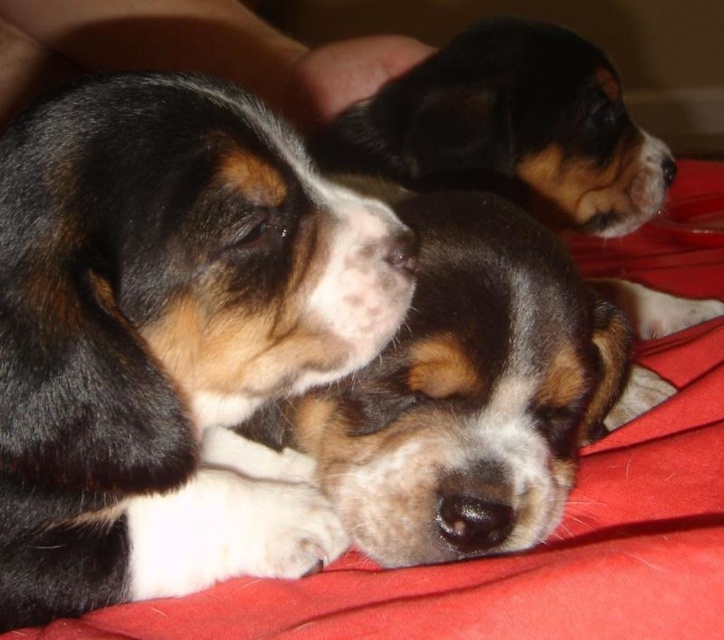
Is point (433, 426) closer to viewer compared to point (319, 60)?

Yes, it is in front of point (319, 60).

Does tri-color fur beagle at center have a greater height compared to smooth skin hand at upper left?

Yes, tri-color fur beagle at center is taller than smooth skin hand at upper left.

Identify the location of tri-color fur beagle at center. (488, 296).

Is tri-color fur puppy at center thinner than smooth skin hand at upper left?

Yes, tri-color fur puppy at center is thinner than smooth skin hand at upper left.

Is point (253, 486) positioned before point (277, 64)?

Yes, point (253, 486) is in front of point (277, 64).

Does point (38, 589) lie behind point (294, 72)?

That is False.

You are a GUI agent. You are given a task and a screenshot of the screen. Output one action in this format:
    pyautogui.click(x=<x>, y=<y>)
    Task: Click on the tri-color fur puppy at center
    Image resolution: width=724 pixels, height=640 pixels.
    Given the screenshot: What is the action you would take?
    pyautogui.click(x=169, y=339)

Which is in front, point (266, 189) or point (471, 412)?

Positioned in front is point (266, 189).

At what (x,y) coordinates should I click in order to perform the action: click on tri-color fur puppy at center. Please return your answer as a coordinate pair (x, y). This screenshot has width=724, height=640. Looking at the image, I should click on (169, 339).